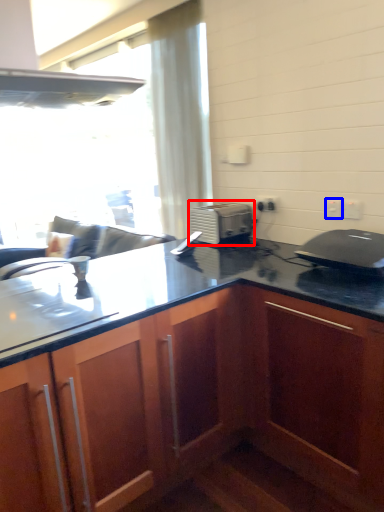
Question: Which point is closer to the camera, toaster (highlighted by a red box) or electric outlet (highlighted by a blue box)?

Choices:
 (A) toaster
 (B) electric outlet

Answer: (B)